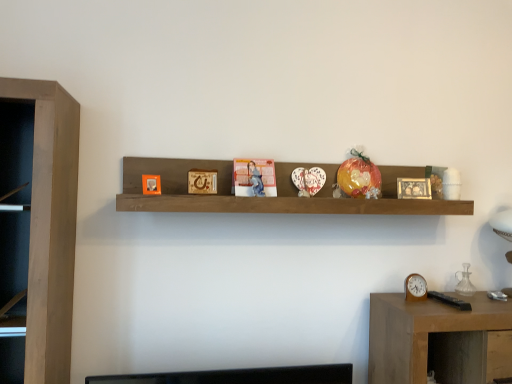
Locate an element on the screen. vacant area that lies in front of wooden clock at right is located at coordinates (420, 311).